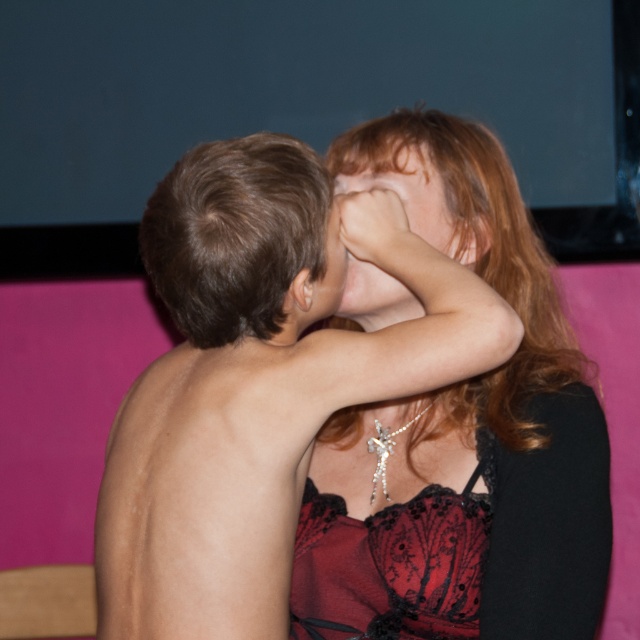
Is the position of velvet lace dress at center more distant than that of smooth skin forehead at upper center?

No.

Is velvet lace dress at center to the right of smooth skin forehead at upper center from the viewer's perspective?

Yes, velvet lace dress at center is to the right of smooth skin forehead at upper center.

In order to click on velvet lace dress at center in this screenshot , I will do `click(392, 563)`.

Is velvet lace dress at center further to the viewer compared to matte black face at center?

That is False.

Can you confirm if velvet lace dress at center is wider than matte black face at center?

Yes, velvet lace dress at center is wider than matte black face at center.

Is point (307, 584) positioned before point (433, 221)?

Yes, point (307, 584) is closer to viewer.

Identify the location of velvet lace dress at center. (392, 563).

Is the position of matte black lace dress at center more distant than that of matte black face at center?

No, matte black lace dress at center is in front of matte black face at center.

Which is behind, point (580, 376) or point (356, 278)?

The point (580, 376) is behind.

Is point (353, 563) more distant than point (401, 198)?

No, (353, 563) is closer to viewer.

This screenshot has width=640, height=640. I want to click on matte black lace dress at center, so click(465, 449).